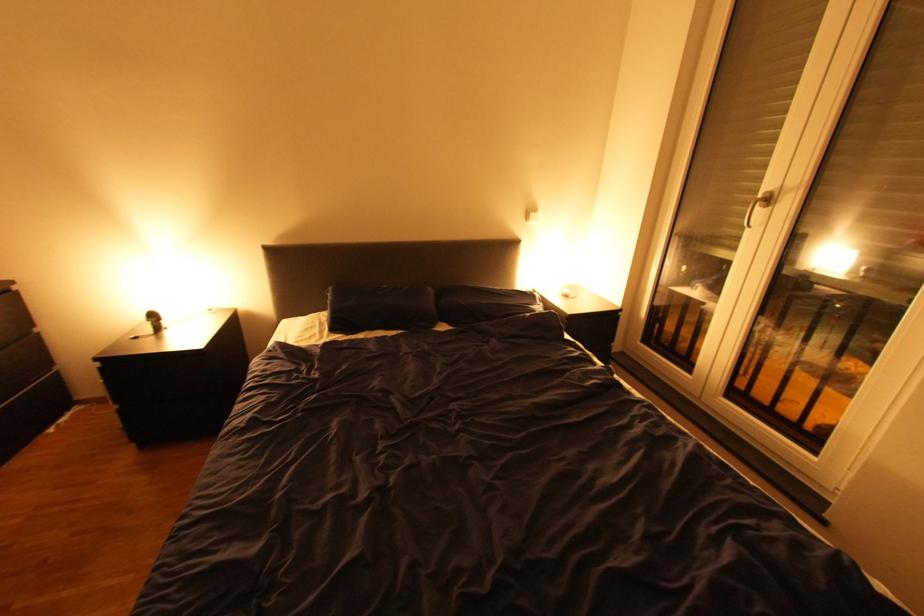
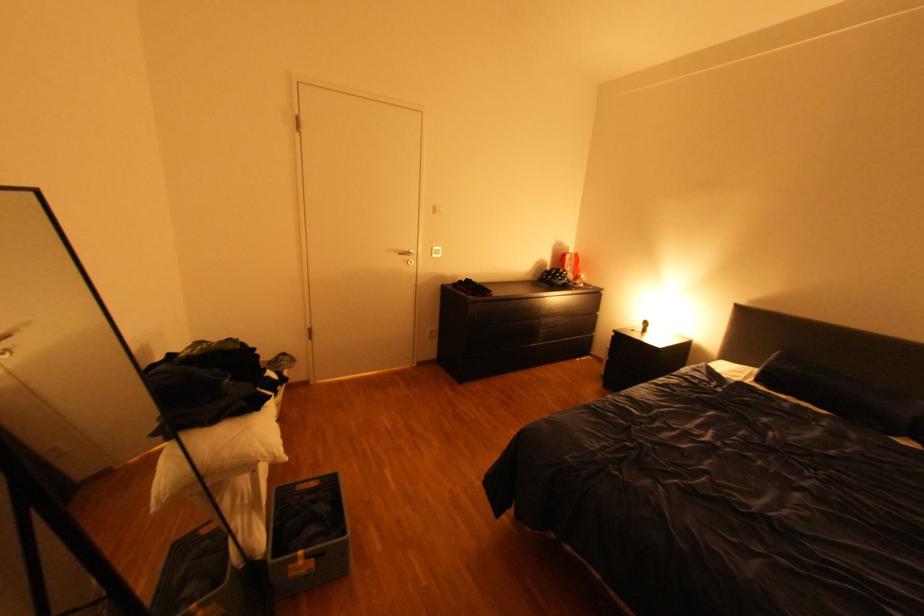
Question: The images are taken continuously from a first-person perspective. In which direction is your viewpoint rotating?

Choices:
 (A) Left
 (B) Right
 (C) Up
 (D) Down

Answer: (A)